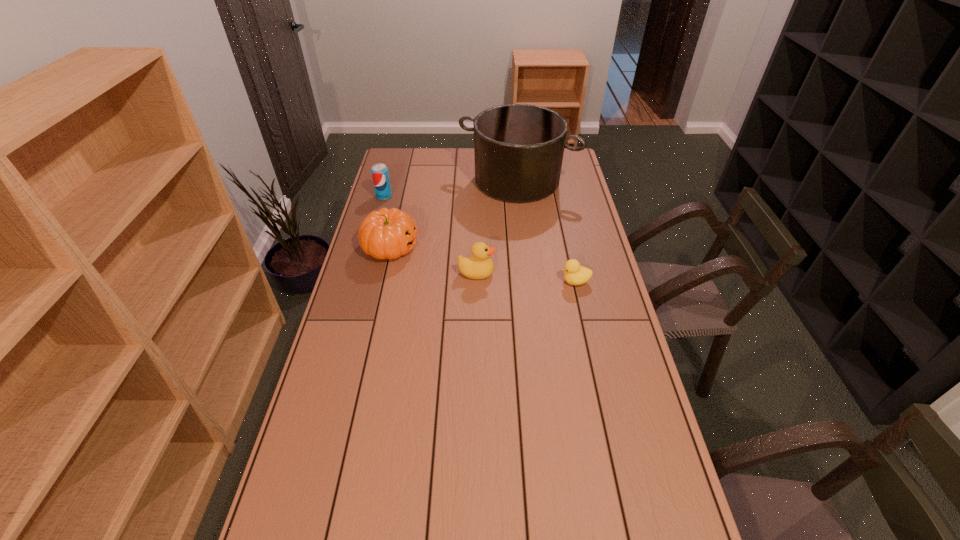
Image resolution: width=960 pixels, height=540 pixels. Identify the location of pan. (518, 148).

You are a GUI agent. You are given a task and a screenshot of the screen. Output one action in this format:
    pyautogui.click(x=<x>, y=<y>)
    Task: Click on the pumpkin
    
    Given the screenshot: What is the action you would take?
    pyautogui.click(x=386, y=233)

Find the location of a particular element. The image size is (960, 540). soda can is located at coordinates (380, 176).

Identify the location of the left duck. The height and width of the screenshot is (540, 960). (480, 266).

You are a GUI agent. You are given a task and a screenshot of the screen. Output one action in this format:
    pyautogui.click(x=<x>, y=<y>)
    Task: Click on the right duck
    This screenshot has height=540, width=960.
    Given the screenshot: What is the action you would take?
    pyautogui.click(x=574, y=274)

Identify the location of the shortest object. The width and height of the screenshot is (960, 540). (574, 274).

This screenshot has height=540, width=960. I want to click on vacant space located on the left of the pan, so click(x=409, y=180).

The height and width of the screenshot is (540, 960). I want to click on blank area located on the carved face of the pumpkin, so click(511, 247).

Locate an element on the screen. The width and height of the screenshot is (960, 540). free space located 0.260m on the right of the soda can is located at coordinates (451, 196).

Find the location of a particular element. This screenshot has width=960, height=540. free region located 0.220m at the beak of the taller duck is located at coordinates (556, 273).